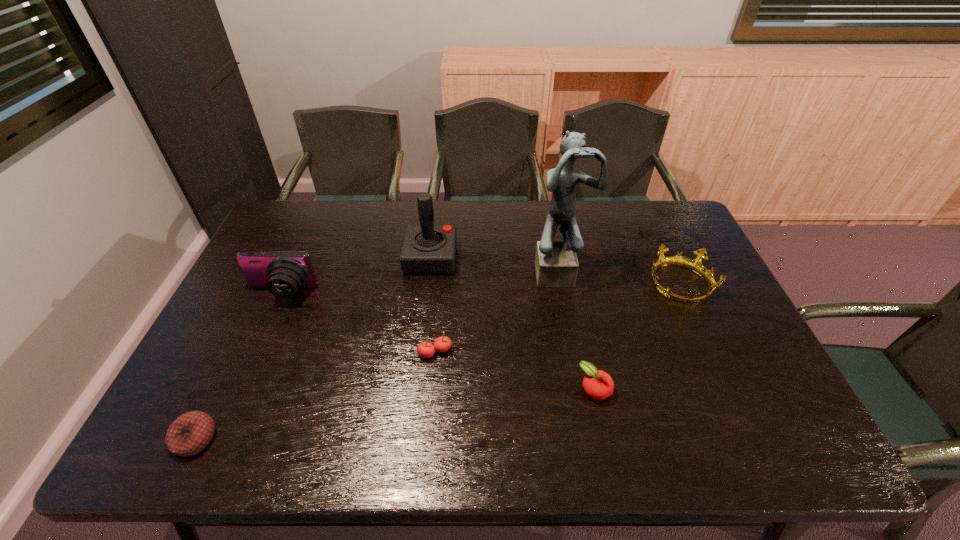
Image resolution: width=960 pixels, height=540 pixels. I want to click on free space at the far edge of the desktop, so click(x=604, y=224).

In the image, there is a desktop. At what (x,y) coordinates should I click in order to perform the action: click on free region at the near edge. Please return your answer as a coordinate pair (x, y). The width and height of the screenshot is (960, 540). Looking at the image, I should click on (492, 424).

You are a GUI agent. You are given a task and a screenshot of the screen. Output one action in this format:
    pyautogui.click(x=<x>, y=<y>)
    Task: Click on the vacant space at the left edge
    Image resolution: width=960 pixels, height=540 pixels.
    Given the screenshot: What is the action you would take?
    pyautogui.click(x=219, y=350)

I want to click on vacant area at the right edge, so click(x=674, y=281).

The height and width of the screenshot is (540, 960). In the image, there is a desktop. Identify the location of free space at the near left corner. (147, 458).

Image resolution: width=960 pixels, height=540 pixels. Find the location of `vacant space at the far right corner of the desktop`. vacant space at the far right corner of the desktop is located at coordinates (651, 228).

Where is `vacant space at the near right corner of the desktop`? The width and height of the screenshot is (960, 540). vacant space at the near right corner of the desktop is located at coordinates (787, 450).

Locate an element on the screen. blank region between the sixth farthest object and the rightmost object is located at coordinates (637, 337).

In order to click on free space between the crown and the second nearest object in this screenshot , I will do `click(637, 337)`.

Find the location of `vacant area that lies between the third tallest object and the second tallest object`. vacant area that lies between the third tallest object and the second tallest object is located at coordinates (356, 276).